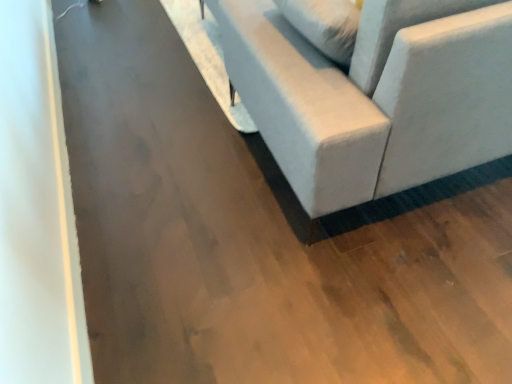
Question: Should I look upward or downward to see textured fabric couch at center?

Choices:
 (A) down
 (B) up

Answer: (B)